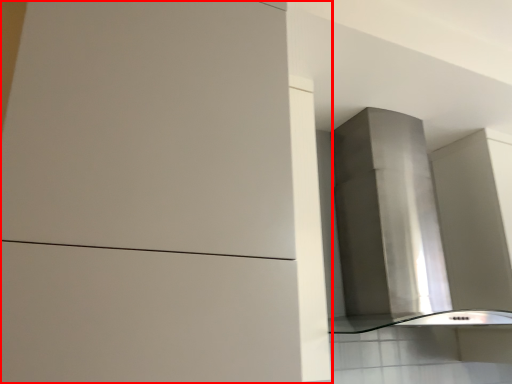
Question: Where is cabinetry (annotated by the red box) located in relation to vent in the image?

Choices:
 (A) right
 (B) left

Answer: (B)